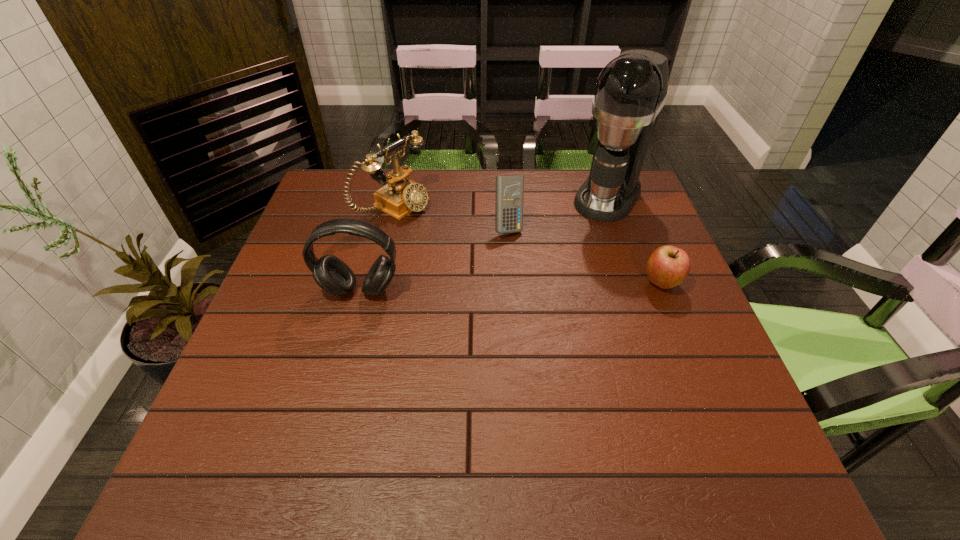
I want to click on headset, so click(335, 277).

In order to click on the shortest object in this screenshot , I will do `click(667, 266)`.

This screenshot has height=540, width=960. Identify the location of telephone. (401, 196).

The image size is (960, 540). In order to click on calculator in this screenshot , I will do `click(509, 188)`.

Where is `the second shortest object`? Image resolution: width=960 pixels, height=540 pixels. the second shortest object is located at coordinates (509, 188).

At what (x,y) coordinates should I click in order to perform the action: click on coffee maker. Please return your answer as a coordinate pair (x, y). Looking at the image, I should click on coord(631,90).

At what (x,y) coordinates should I click in order to perform the action: click on free region located 0.180m on the earcups of the headset. Please return your answer as a coordinate pair (x, y). Looking at the image, I should click on (340, 368).

Locate an element on the screen. Image resolution: width=960 pixels, height=540 pixels. vacant area situated 0.260m on the front of the shortest object is located at coordinates (706, 395).

Where is `free space located on the dial number of the telephone`? The height and width of the screenshot is (540, 960). free space located on the dial number of the telephone is located at coordinates (476, 253).

The height and width of the screenshot is (540, 960). What are the coordinates of `vacant region located on the dial number of the telephone` in the screenshot? It's located at (473, 251).